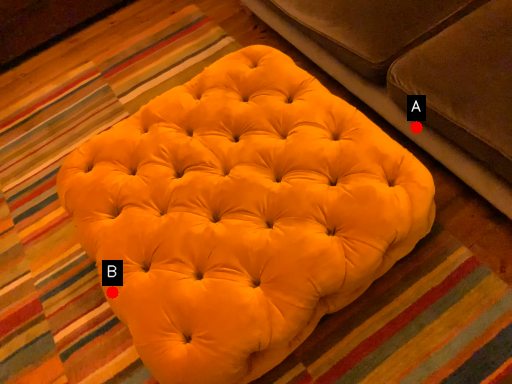
Question: Two points are circled on the image, labeled by A and B beside each circle. Among these points, which one is farthest from the camera?

Choices:
 (A) A is further
 (B) B is further

Answer: (A)